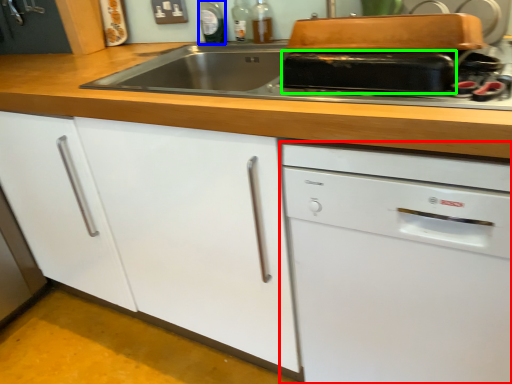
Question: Estimate the real-world distances between objects in this image. Which object is closer to home appliance (highlighted by a red box), bottle (highlighted by a blue box) or kitchen appliance (highlighted by a green box)?

Choices:
 (A) bottle
 (B) kitchen appliance

Answer: (B)